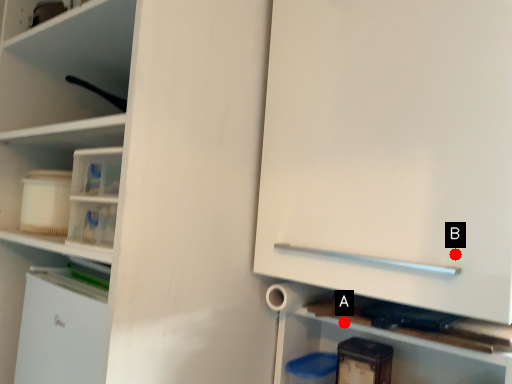
Question: Two points are circled on the image, labeled by A and B beside each circle. Which point is closer to the camera?

Choices:
 (A) A is closer
 (B) B is closer

Answer: (B)